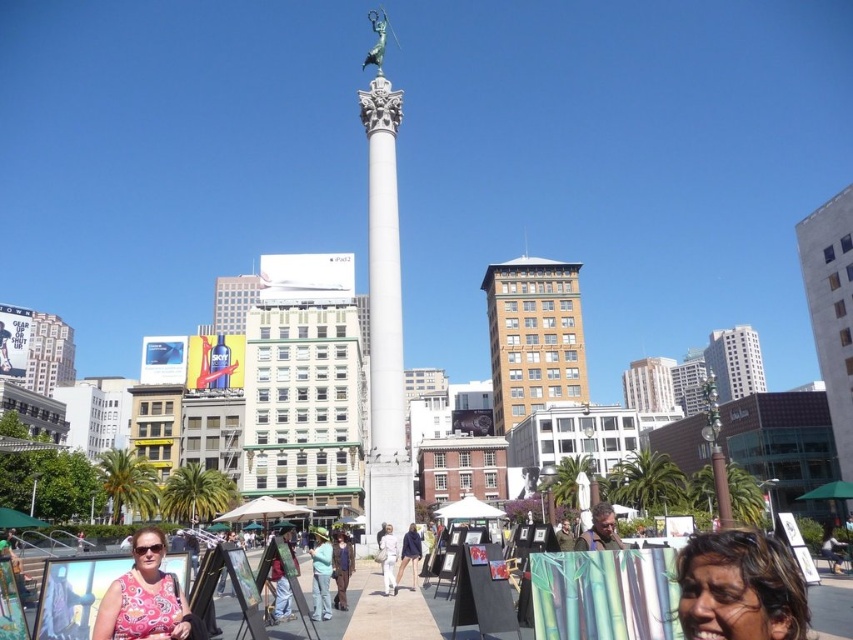
Based on the photo, you are an artist at the outdoor art market and want to display two paintings side by side on an easel. The first painting depicts the denim pants at center, and the second shows the light blue denim jeans at center. If you want to ensure both paintings are visible without overlapping, which painting should you place on the left to accommodate their widths?

The denim pants at center is wider than the light blue denim jeans at center. To display them side by side without overlapping, place the denim pants at center on the left so there is enough space for both paintings.

Consider the image. You are standing at the monument and want to walk to the art market. There are two points marked on your map at coordinates point (320, 528) and point (343, 556). Which point is closer to the monument?

Point (320, 528) is behind point (343, 556), so the closer point to the monument would be point (343, 556).